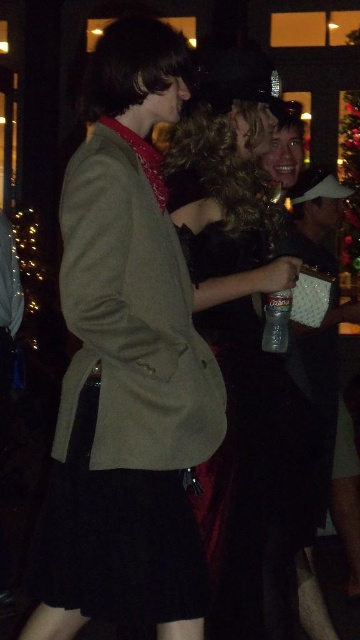
Question: Can you confirm if black cotton dress at center is bigger than velvet black dress at center?

Choices:
 (A) no
 (B) yes

Answer: (A)

Question: Does black cotton dress at center lie behind green fabric christmas tree at upper right?

Choices:
 (A) no
 (B) yes

Answer: (A)

Question: Can you confirm if velvet black dress at center is smaller than green fabric christmas tree at upper right?

Choices:
 (A) yes
 (B) no

Answer: (B)

Question: Among these objects, which one is nearest to the camera?

Choices:
 (A) black cotton dress at center
 (B) green fabric christmas tree at upper right

Answer: (A)

Question: Which point is farther to the camera?

Choices:
 (A) black cotton dress at center
 (B) velvet black dress at center

Answer: (B)

Question: Which point appears farthest from the camera in this image?

Choices:
 (A) (347, 177)
 (B) (127, 472)
 (C) (307, 403)

Answer: (A)